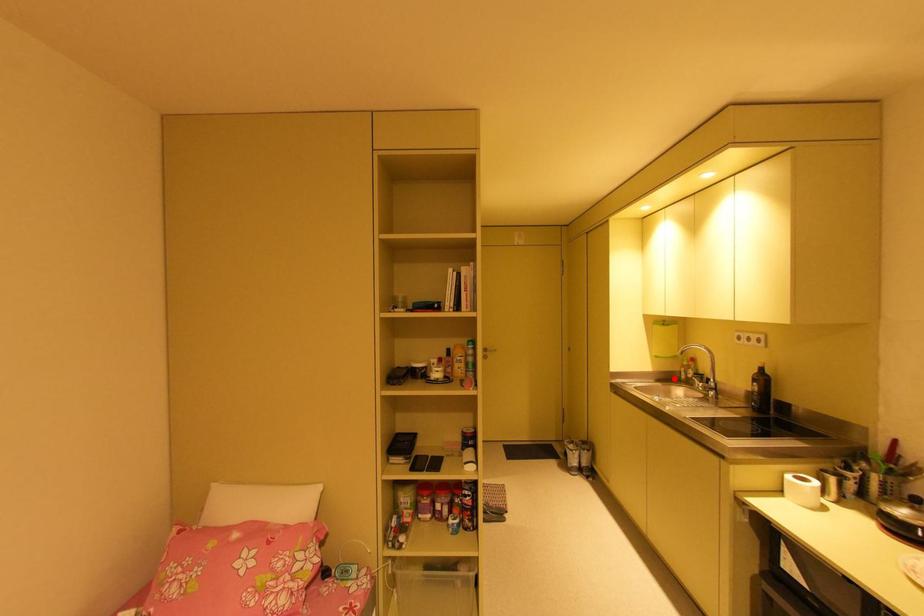
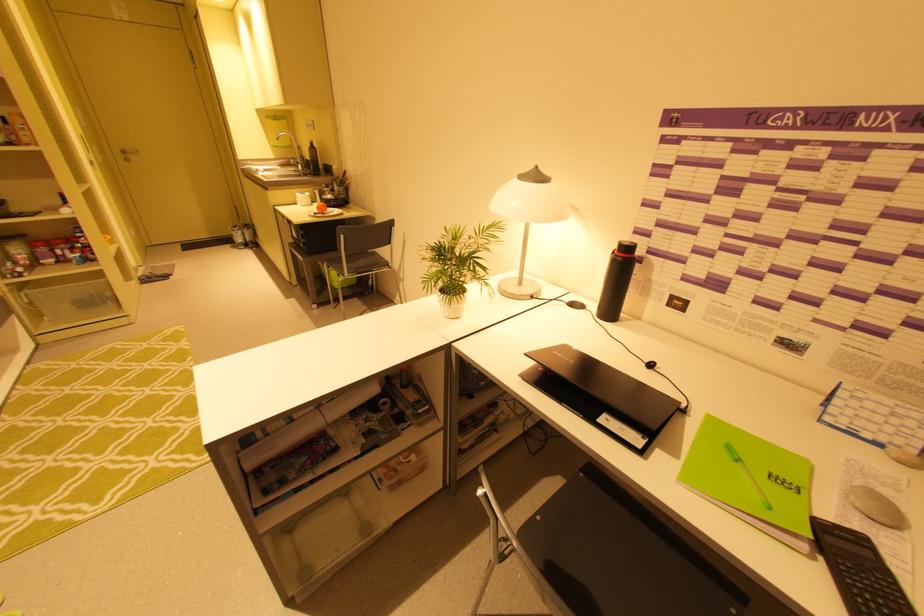
Locate, in the second image, the point that corresponds to the highlighted location in the first image.

(293, 164)